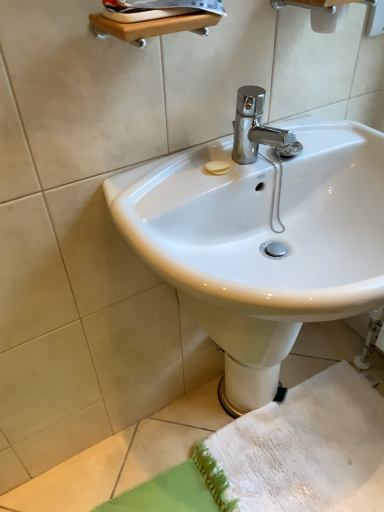
Identify the location of vacant space in between white textured towel at lower right and white glossy bidet at lower center. Image resolution: width=384 pixels, height=512 pixels. (225, 414).